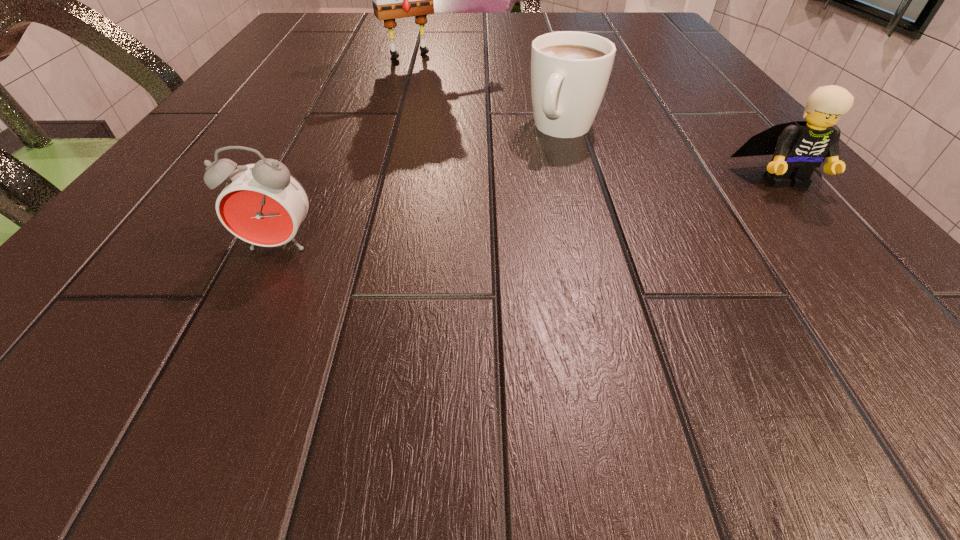
You are a GUI agent. You are given a task and a screenshot of the screen. Output one action in this format:
    pyautogui.click(x=<x>, y=<y>)
    Task: Click on the free space on the desktop that is between the nearest object and the rightmost object and is positioned with the handle on the side of the second farthest object
    This screenshot has height=540, width=960.
    Given the screenshot: What is the action you would take?
    pyautogui.click(x=502, y=215)

You are a GUI agent. You are given a task and a screenshot of the screen. Output one action in this format:
    pyautogui.click(x=<x>, y=<y>)
    Task: Click on the free space on the desktop that is between the nearest object and the third farthest object and is positioned on the face of the sponge
    The width and height of the screenshot is (960, 540).
    Given the screenshot: What is the action you would take?
    pyautogui.click(x=537, y=211)